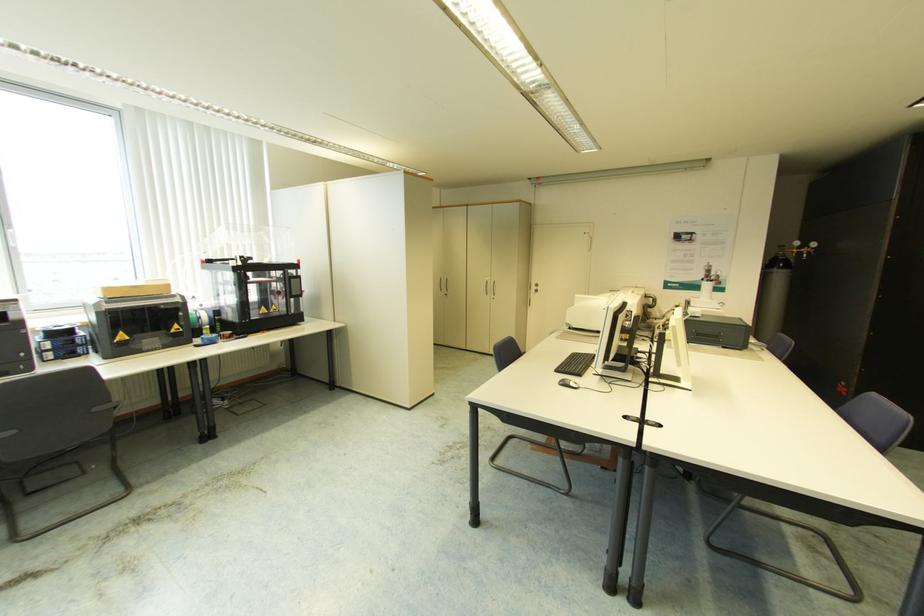
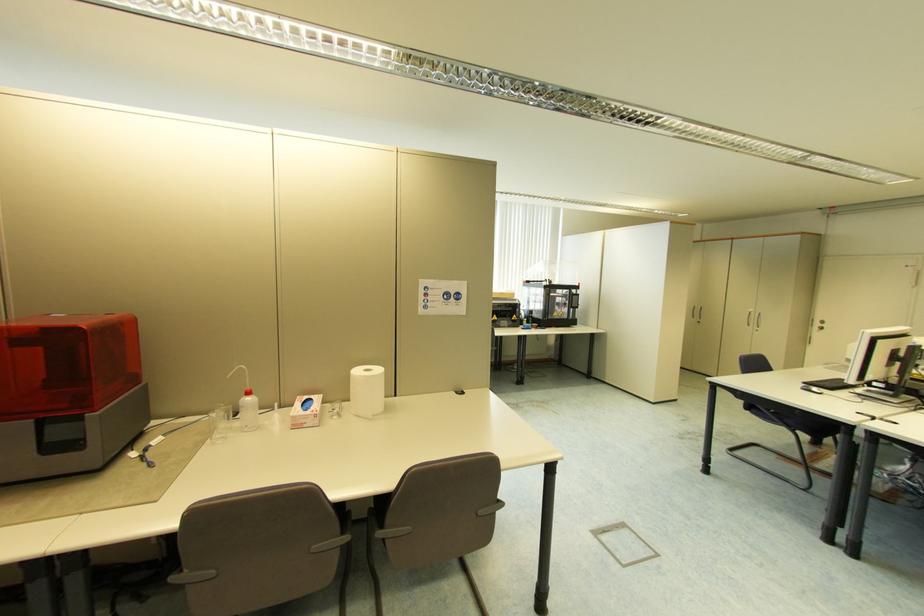
In the second image, find the point that corresponds to (537,288) in the first image.

(821, 325)